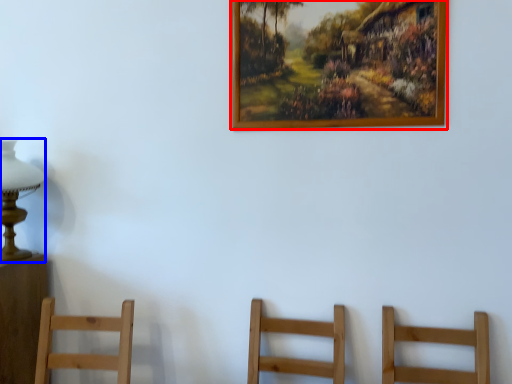
Question: Among these objects, which one is farthest to the camera, picture frame (highlighted by a red box) or table lamp (highlighted by a blue box)?

Choices:
 (A) picture frame
 (B) table lamp

Answer: (B)